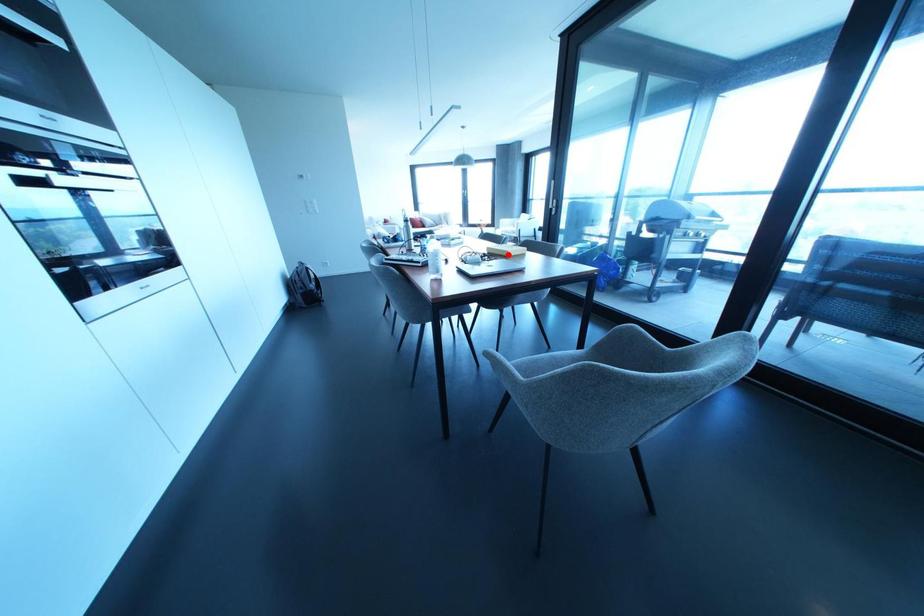
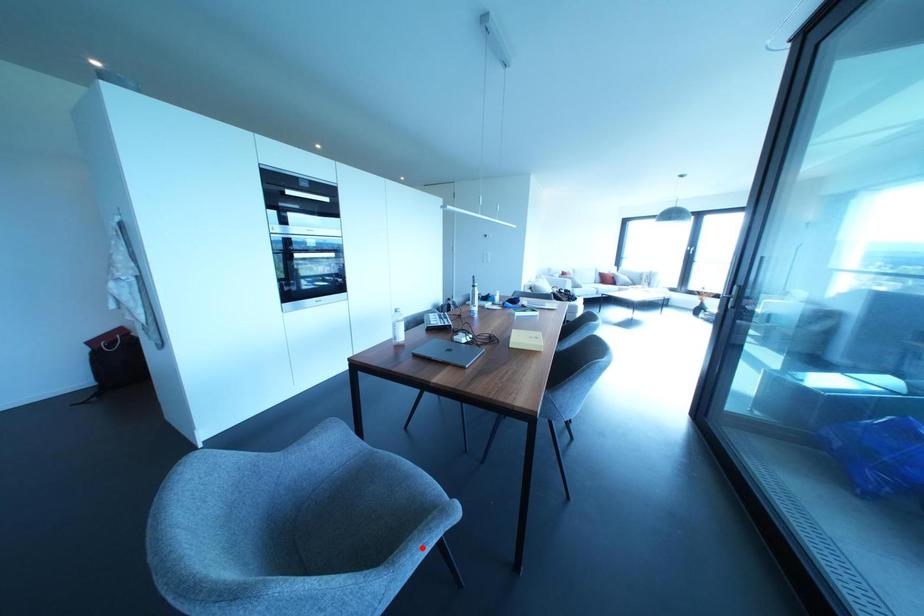
I am providing you with two images of the same scene from different viewpoints. A red point is marked on the first image and another point is marked on the second image. Does the point marked in image1 correspond to the same location as the one in image2?

No